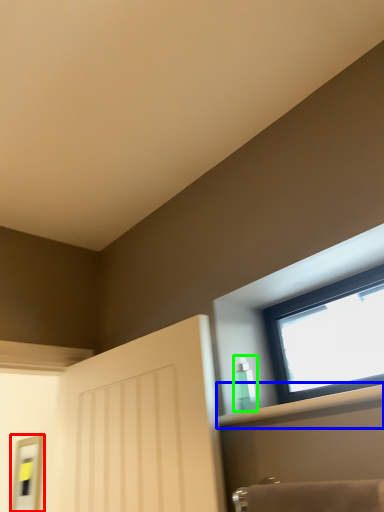
Question: Which is farther away from mirror (highlighted by a red box)? shelf (highlighted by a blue box) or toiletry (highlighted by a green box)?

Choices:
 (A) shelf
 (B) toiletry

Answer: (A)